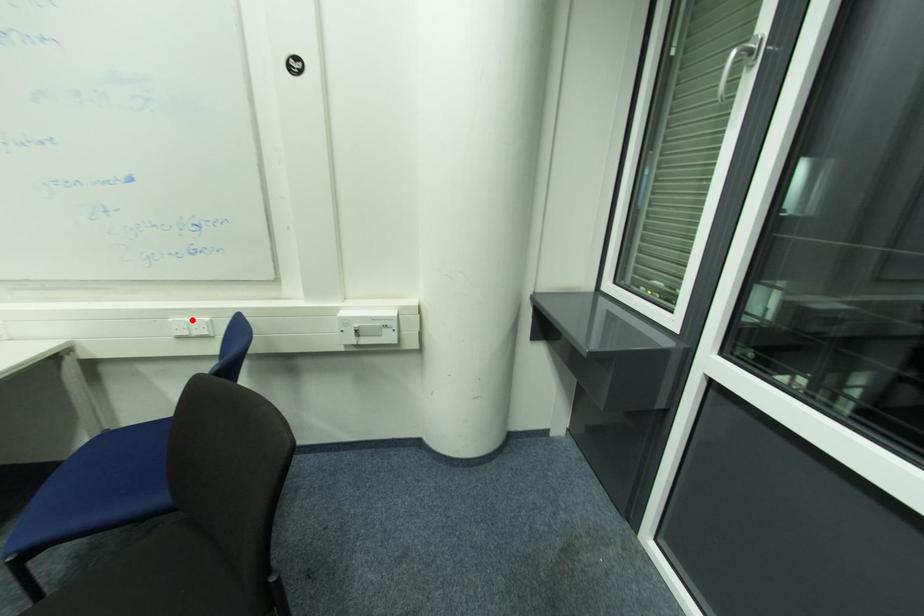
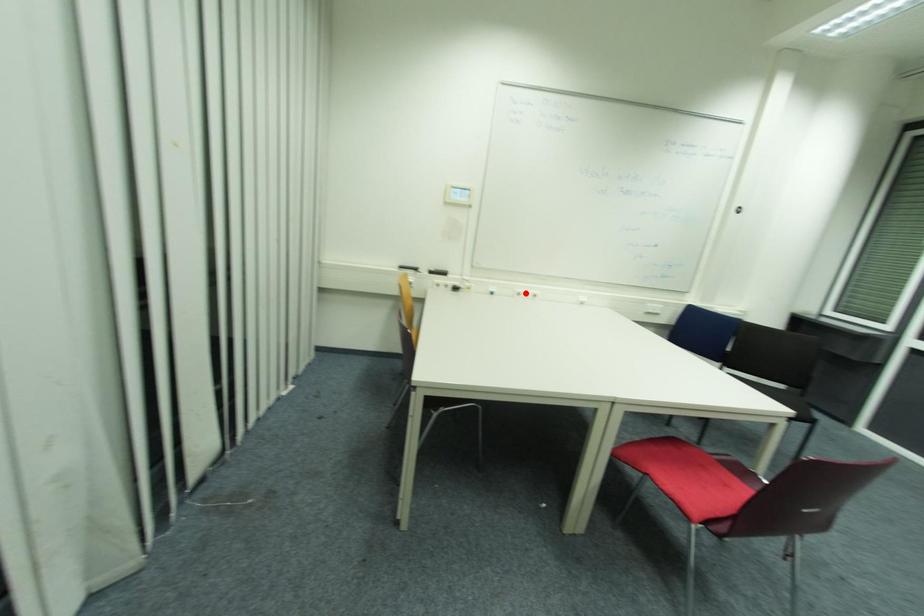
I am providing you with two images of the same scene from different viewpoints. A red point is marked on the first image and another point is marked on the second image. Do the highlighted points in image1 and image2 indicate the same real-world spot?

No